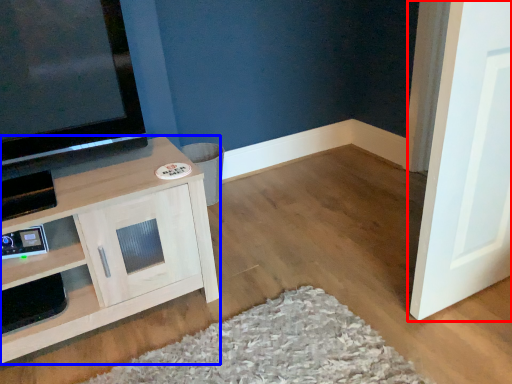
Question: Which object appears closest to the camera in this image, door (highlighted by a red box) or cabinetry (highlighted by a blue box)?

Choices:
 (A) door
 (B) cabinetry

Answer: (A)